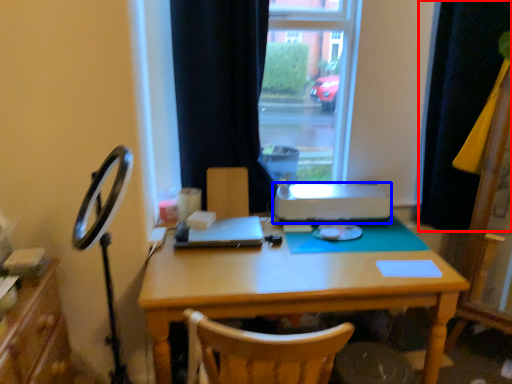
Question: Among these objects, which one is farthest to the camera, curtain (highlighted by a red box) or printer (highlighted by a blue box)?

Choices:
 (A) curtain
 (B) printer

Answer: (B)